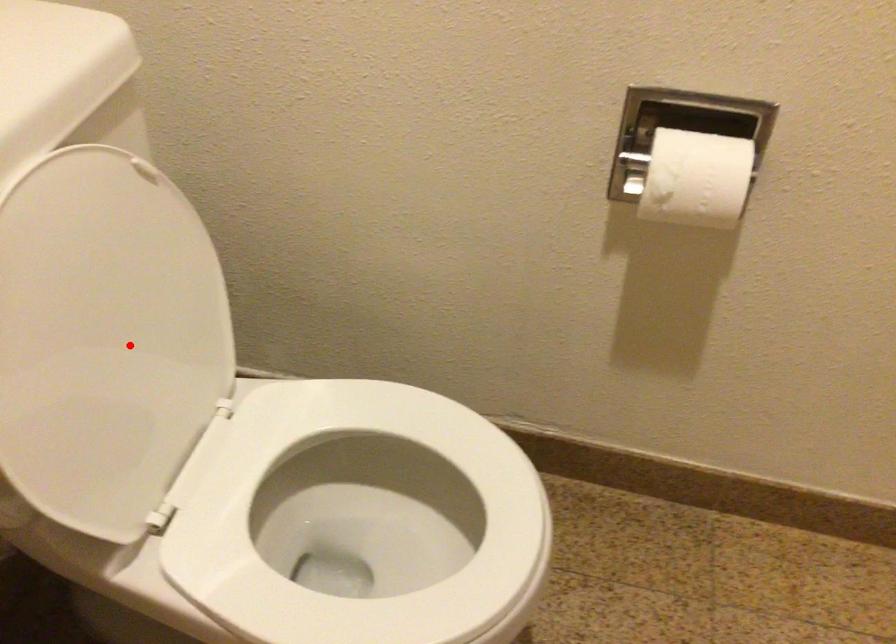
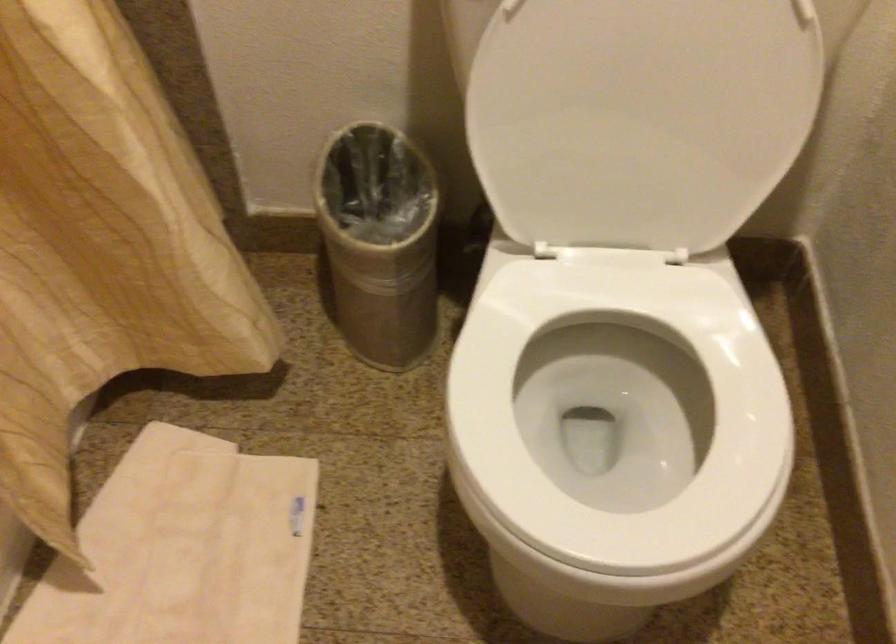
In the second image, find the point that corresponds to the highlighted location in the first image.

(640, 118)